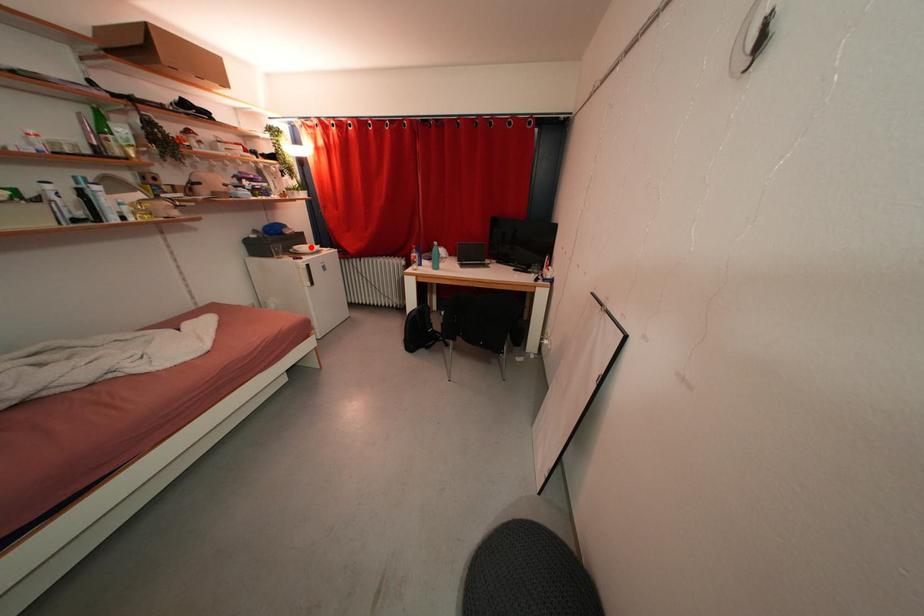
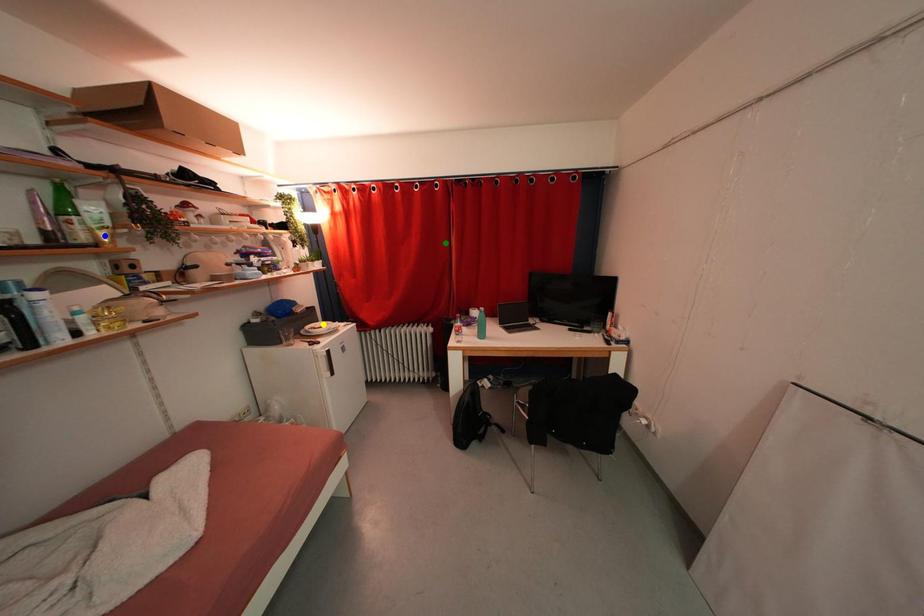
Question: I am providing you with two images of the same scene from different viewpoints. A red point is marked on the first image. You are given multiple points on the second image. Which spot in image 2 lines up with the point in image 1?

Choices:
 (A) blue point
 (B) green point
 (C) yellow point

Answer: (C)